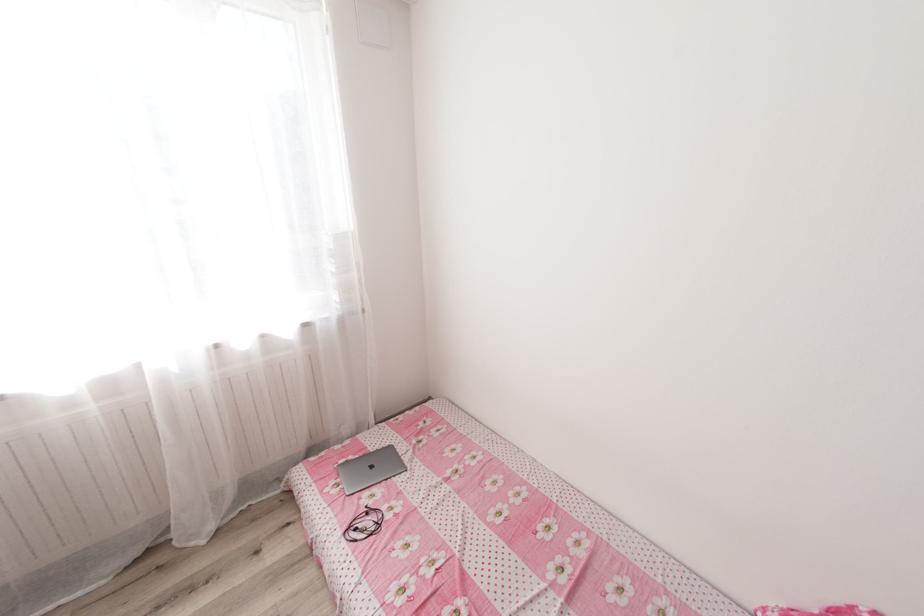
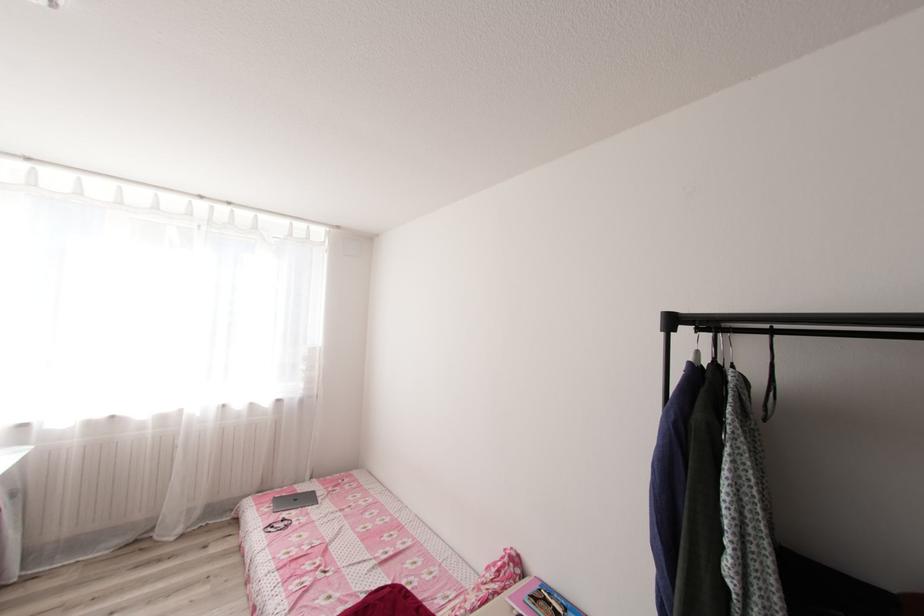
What movement of the cameraman would produce the second image?

The cameraman moved toward right, backward.